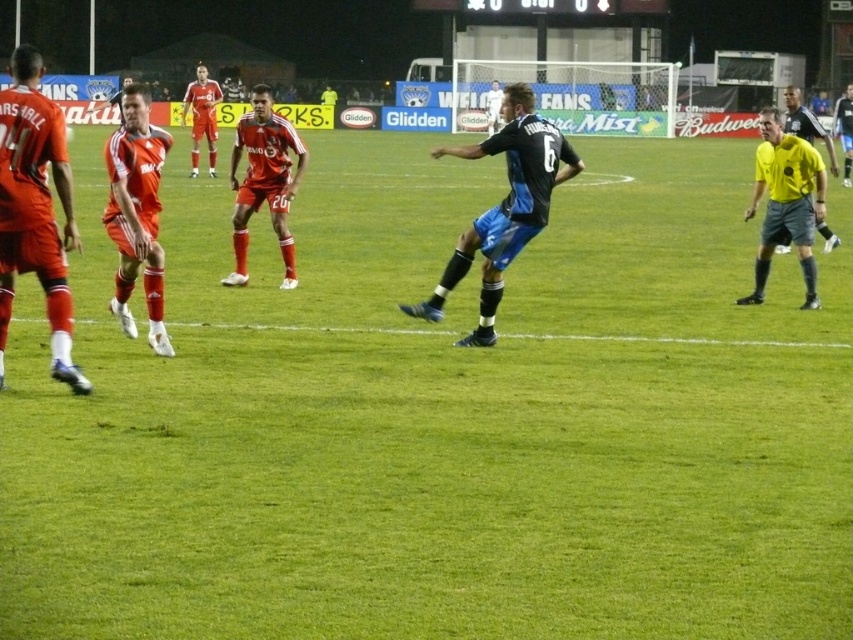
Question: Is matte red soccer uniform at left behind matte red shorts at left?

Choices:
 (A) no
 (B) yes

Answer: (A)

Question: Which object is positioned farthest from the yellow jersey at right?

Choices:
 (A) matte red soccer uniform at left
 (B) matte orange jersey at center
 (C) black jersey at center
 (D) orange jersey at left

Answer: (A)

Question: Which of the following is the farthest from the observer?

Choices:
 (A) (1, 106)
 (B) (62, 352)
 (C) (219, 97)
 (D) (554, 170)

Answer: (C)

Question: From the image, what is the correct spatial relationship of orange jersey at left in relation to matte red uniform at upper center?

Choices:
 (A) right
 (B) left

Answer: (A)

Question: Does black jersey at center have a smaller size compared to orange jersey at left?

Choices:
 (A) no
 (B) yes

Answer: (A)

Question: Which object is the closest to the matte red shorts at left?

Choices:
 (A) orange jersey at left
 (B) black jersey at center
 (C) matte red uniform at upper center

Answer: (A)